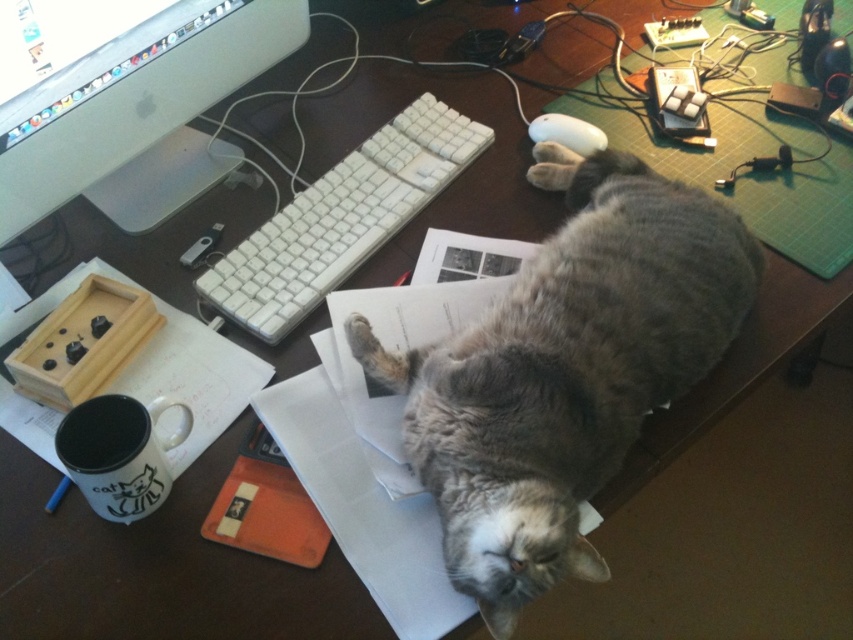
Question: Among these points, which one is nearest to the camera?

Choices:
 (A) (590, 131)
 (B) (515, 611)
 (C) (126, 122)

Answer: (B)

Question: Can you confirm if sleek silver monitor at upper left is smaller than white ceramic mug at lower left?

Choices:
 (A) no
 (B) yes

Answer: (A)

Question: Which of these objects is positioned farthest from the white matte mouse at upper right?

Choices:
 (A) gray fluffy cat at center
 (B) sleek silver monitor at upper left
 (C) white ceramic mug at lower left
 (D) white plastic keyboard at center

Answer: (C)

Question: Can you confirm if white ceramic mug at lower left is positioned to the right of white matte mouse at upper right?

Choices:
 (A) yes
 (B) no

Answer: (B)

Question: Does sleek silver monitor at upper left have a smaller size compared to white matte mouse at upper right?

Choices:
 (A) no
 (B) yes

Answer: (A)

Question: Which is farther from the white plastic keyboard at center?

Choices:
 (A) sleek silver monitor at upper left
 (B) white matte mouse at upper right

Answer: (B)